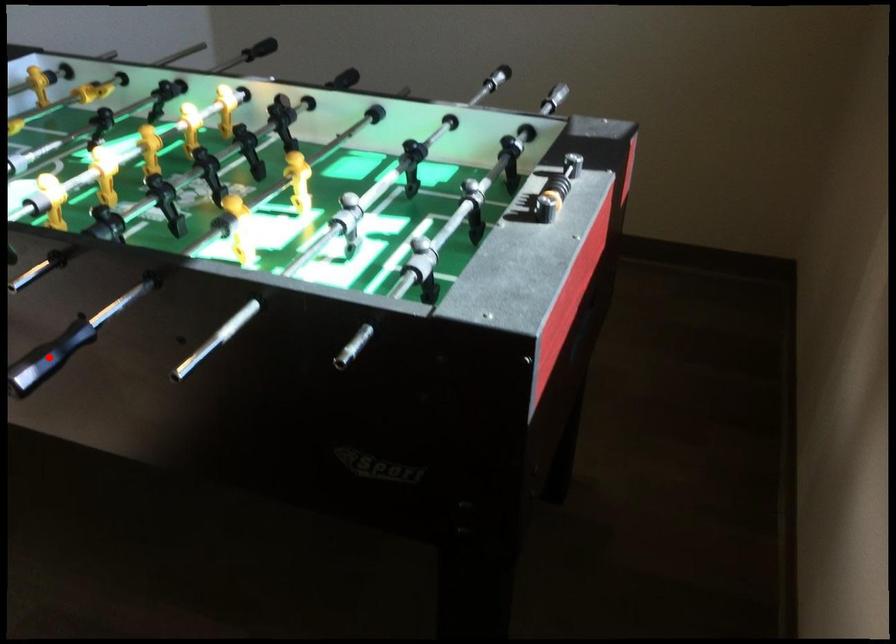
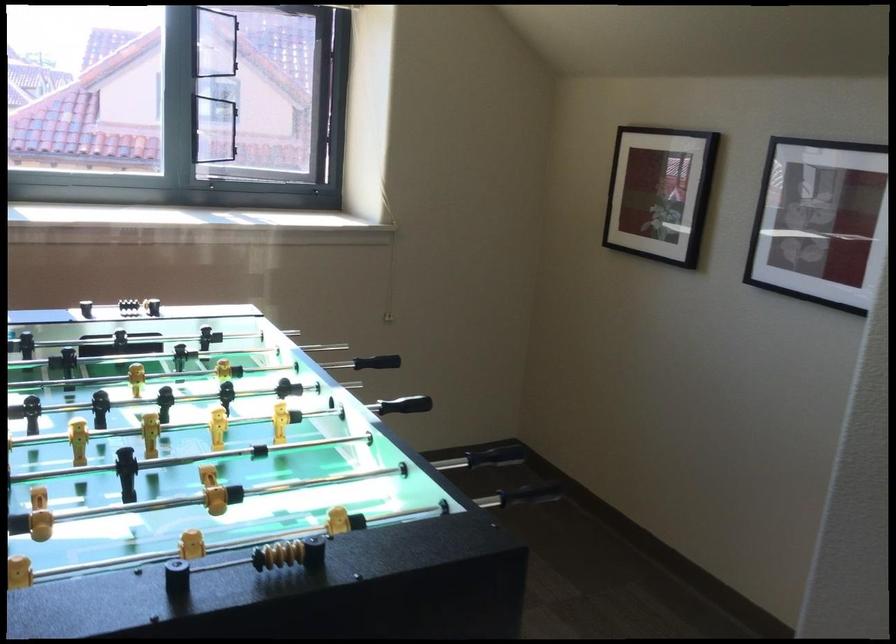
Question: I am providing you with two images of the same scene from different viewpoints. A red point is shown in image1. For the corresponding object point in image2, is it positioned nearer or farther from the camera?

Choices:
 (A) Nearer
 (B) Farther

Answer: (B)